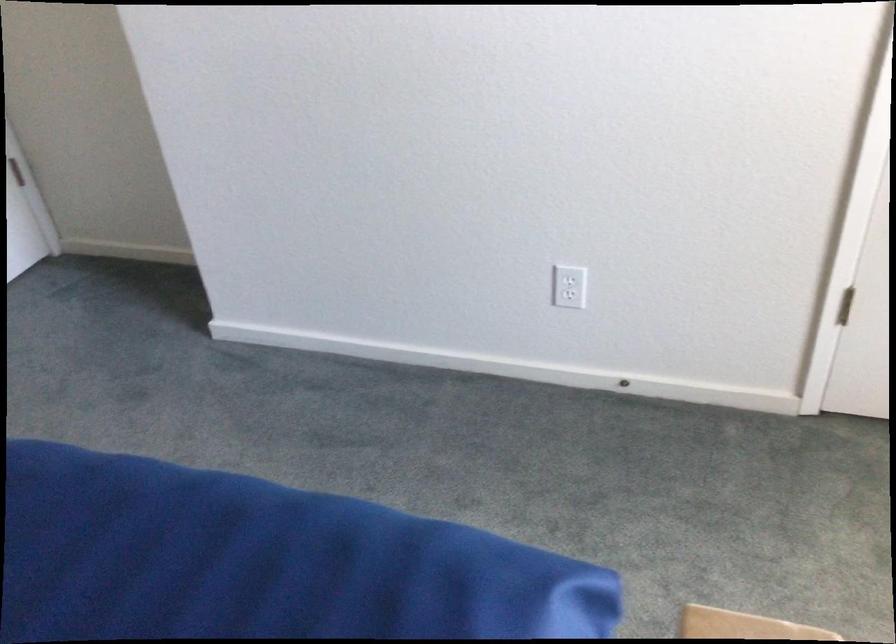
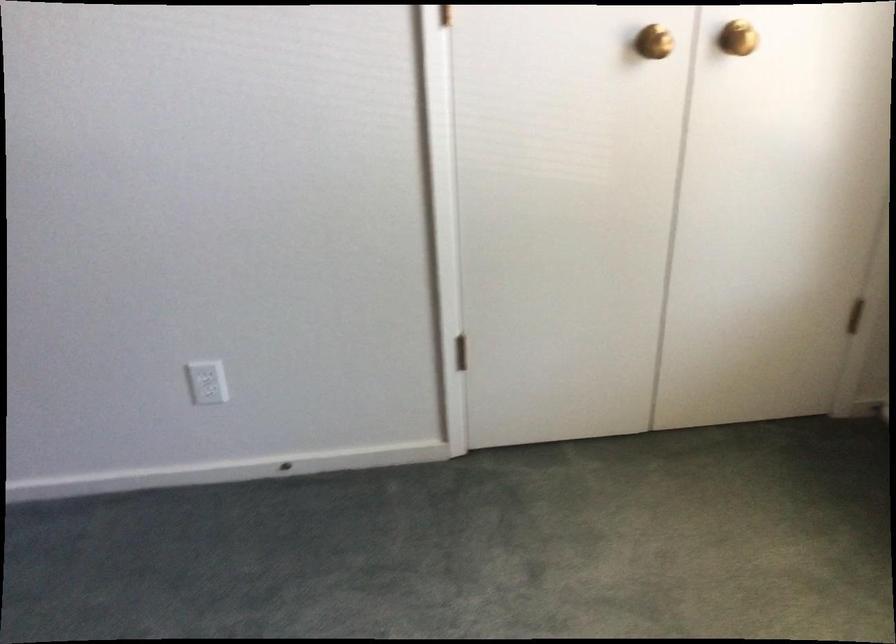
Question: The camera is either moving clockwise (left) or counter-clockwise (right) around the object. The first image is from the beginning of the video and the second image is from the end. Is the camera moving left or right when shooting the video?

Choices:
 (A) Left
 (B) Right

Answer: (A)